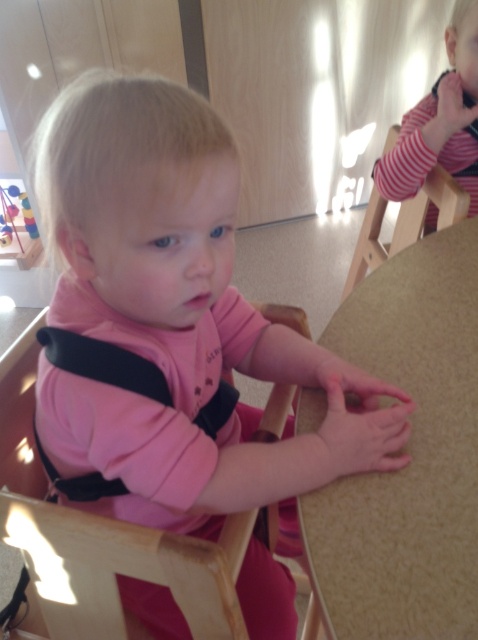
Is wooden chair at center below wooden chair at upper right?

Correct, wooden chair at center is located below wooden chair at upper right.

Is wooden chair at center positioned before wooden chair at upper right?

Yes, it is in front of wooden chair at upper right.

Is point (283, 392) farther from viewer compared to point (395, 248)?

No, it is not.

Locate an element on the screen. The width and height of the screenshot is (478, 640). wooden chair at center is located at coordinates (20, 417).

From the picture: Can you confirm if wooden chair at center is shorter than striped fabric shirt at upper right?

Incorrect, wooden chair at center's height does not fall short of striped fabric shirt at upper right's.

Is wooden chair at center in front of striped fabric shirt at upper right?

Yes, it is in front of striped fabric shirt at upper right.

Measure the distance between wooden chair at center and camera.

wooden chair at center and camera are 48.68 centimeters apart.

What are the coordinates of `wooden chair at center` in the screenshot? It's located at (20, 417).

Where is `pink matte baby carrier at center`? The image size is (478, 640). pink matte baby carrier at center is located at coordinates (173, 326).

Can you confirm if pink matte baby carrier at center is taller than beige textured table at center?

Yes, pink matte baby carrier at center is taller than beige textured table at center.

You are a GUI agent. You are given a task and a screenshot of the screen. Output one action in this format:
    pyautogui.click(x=<x>, y=<y>)
    Task: Click on the pink matte baby carrier at center
    This screenshot has height=640, width=478.
    Given the screenshot: What is the action you would take?
    pyautogui.click(x=173, y=326)